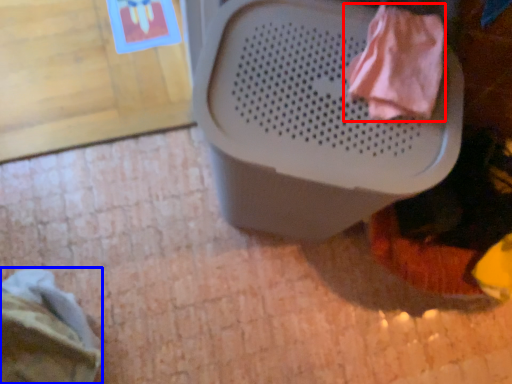
Question: Among these objects, which one is farthest to the camera, clothing (highlighted by a red box) or clothing (highlighted by a blue box)?

Choices:
 (A) clothing
 (B) clothing

Answer: (B)